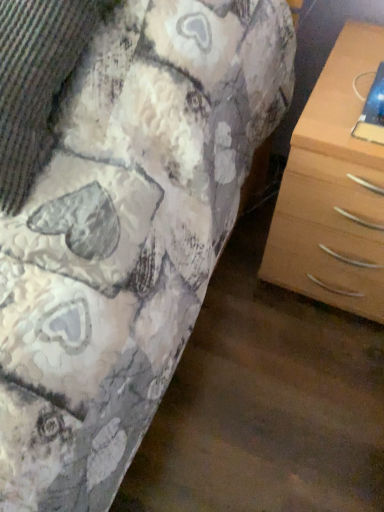
Locate an element on the screen. free space to the left of light brown wooden chest of drawers at right is located at coordinates (235, 292).